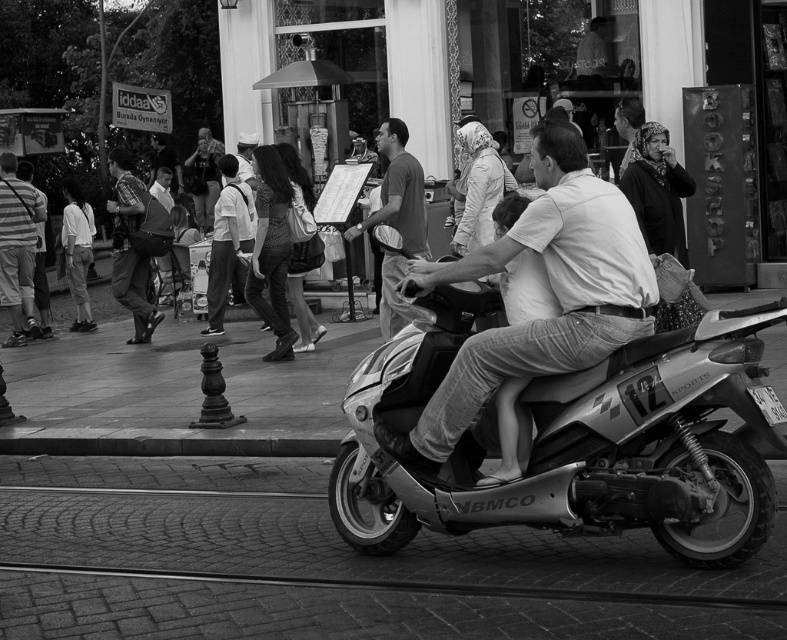
Question: Which point appears closest to the camera in this image?

Choices:
 (A) (17, 211)
 (B) (276, 289)

Answer: (B)

Question: Which point is farther to the camera?

Choices:
 (A) matte silver scooter at center
 (B) matte gray shirt at center

Answer: (B)

Question: Which of the following is the closest to the observer?

Choices:
 (A) matte fabric bag at center
 (B) matte black headscarf at upper right
 (C) checkered shirt at left

Answer: (B)

Question: Can you confirm if metallic silver scooter at center is positioned above matte black headscarf at upper right?

Choices:
 (A) yes
 (B) no

Answer: (B)

Question: Does matte silver scooter at center appear on the right side of leather jacket at upper center?

Choices:
 (A) no
 (B) yes

Answer: (B)

Question: Does matte black headscarf at upper right appear on the left side of matte gray shirt at center?

Choices:
 (A) yes
 (B) no

Answer: (B)